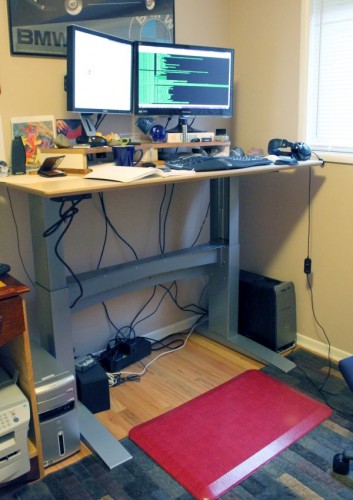
Identify the location of computer cpu. click(254, 309), click(56, 400).